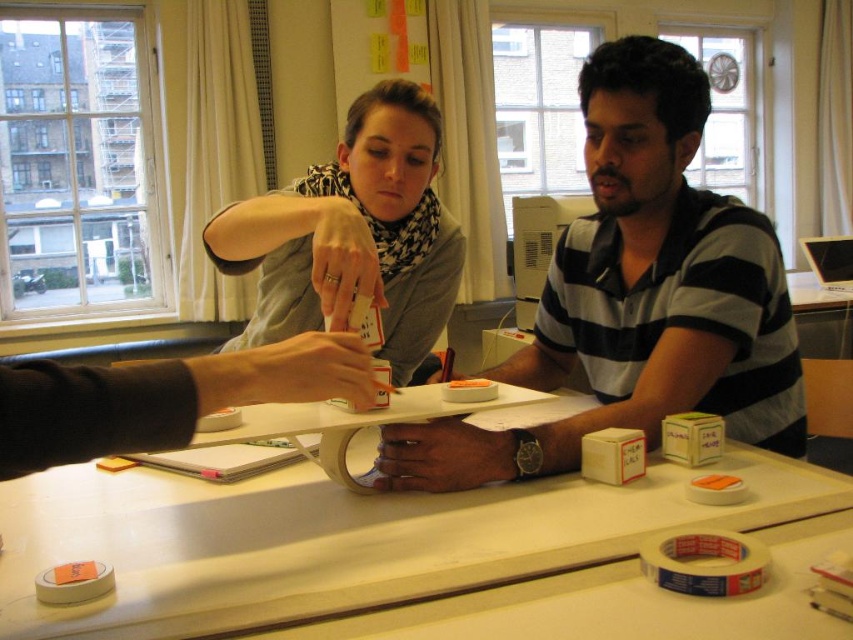
Who is positioned more to the left, white matte table at center or matte black scarf at upper center?

From the viewer's perspective, matte black scarf at upper center appears more on the left side.

From the picture: Between white matte table at center and matte black scarf at upper center, which one appears on the right side from the viewer's perspective?

white matte table at center is more to the right.

Is point (216, 625) less distant than point (322, 228)?

Yes, it is in front of point (322, 228).

The image size is (853, 640). I want to click on white matte table at center, so click(340, 540).

Can you confirm if white matte table at center is positioned above striped cotton polo shirt at center?

Actually, white matte table at center is below striped cotton polo shirt at center.

Consider the image. Does white matte table at center lie behind striped cotton polo shirt at center?

No, white matte table at center is in front of striped cotton polo shirt at center.

Does point (759, 480) lie behind point (753, 232)?

No.

The width and height of the screenshot is (853, 640). In order to click on white matte table at center in this screenshot , I will do `click(340, 540)`.

The width and height of the screenshot is (853, 640). I want to click on striped cotton polo shirt at center, so click(637, 296).